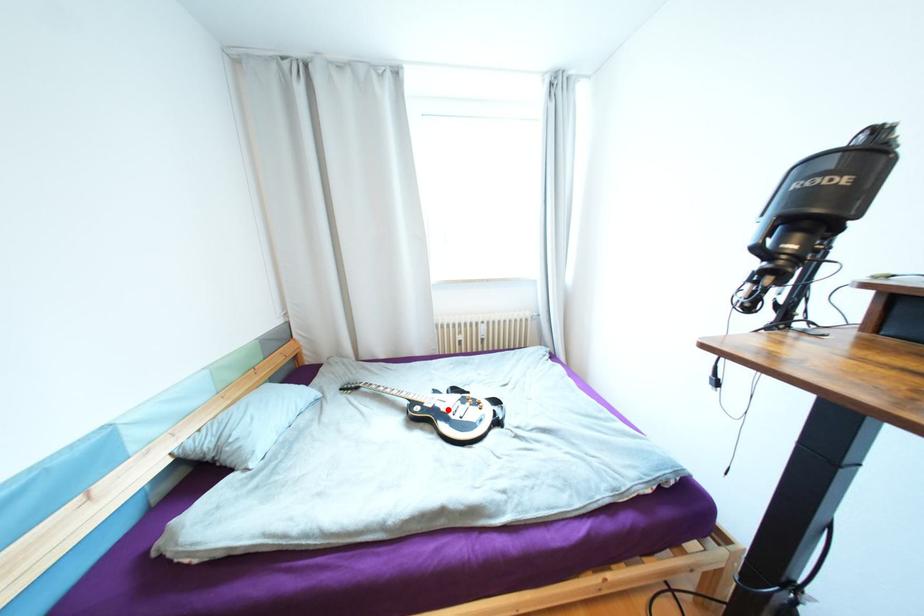
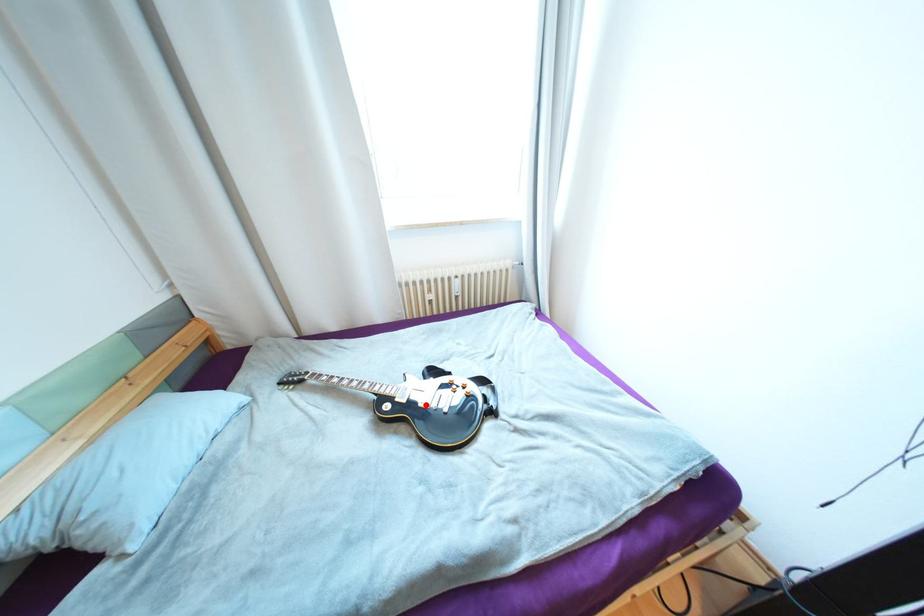
Consider the image. I am providing you with two images of the same scene from different viewpoints. A red point is marked on the first image and another point is marked on the second image. Is the red point in image1 aligned with the point shown in image2?

Yes